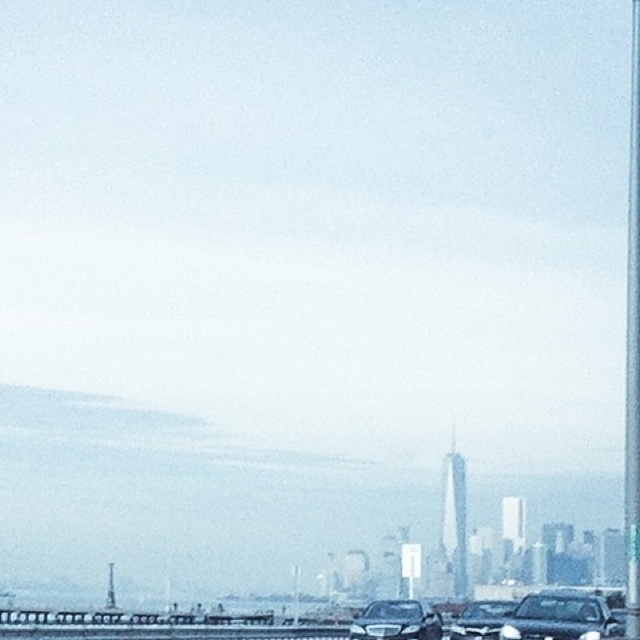
Question: Which point is farther to the camera?

Choices:
 (A) shiny black sedan at lower right
 (B) sleek black car at center
 (C) sleek black car at lower right

Answer: (B)

Question: Which of these objects is positioned farthest from the sleek black car at lower right?

Choices:
 (A) shiny black sedan at lower right
 (B) metallic pole at right

Answer: (B)

Question: In this image, where is shiny black sedan at lower right located relative to sleek black car at lower right?

Choices:
 (A) above
 (B) below

Answer: (A)

Question: Does shiny black sedan at lower right appear under sleek black car at lower right?

Choices:
 (A) yes
 (B) no

Answer: (B)

Question: Which of the following is the farthest from the observer?

Choices:
 (A) (396, 628)
 (B) (532, 636)
 (C) (474, 616)

Answer: (C)

Question: Is metallic pole at right to the right of sleek black car at center from the viewer's perspective?

Choices:
 (A) yes
 (B) no

Answer: (A)